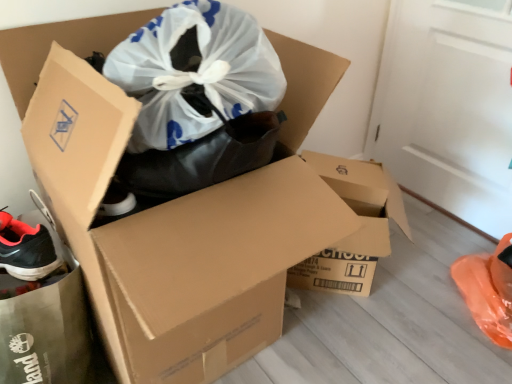
Question: Is black matte shoe at lower left outside of brown cardboard box at center, the 1th box viewed from the right?

Choices:
 (A) no
 (B) yes

Answer: (B)

Question: Can you confirm if black matte shoe at lower left is wider than brown cardboard box at center, the 1th box viewed from the right?

Choices:
 (A) yes
 (B) no

Answer: (A)

Question: Considering the relative sizes of black matte shoe at lower left and brown cardboard box at center, the 1th box viewed from the right, in the image provided, is black matte shoe at lower left bigger than brown cardboard box at center, the 1th box viewed from the right,?

Choices:
 (A) yes
 (B) no

Answer: (B)

Question: Can you confirm if black matte shoe at lower left is thinner than brown cardboard box at center, the second box in the left-to-right sequence?

Choices:
 (A) no
 (B) yes

Answer: (A)

Question: Is brown cardboard box at center, the 1th box viewed from the right, at the back of black matte shoe at lower left?

Choices:
 (A) yes
 (B) no

Answer: (B)

Question: Considering the positions of brown cardboard box at center, positioned as the first box in left-to-right order, and brown cardboard box at center, the second box in the left-to-right sequence, in the image, is brown cardboard box at center, positioned as the first box in left-to-right order, bigger or smaller than brown cardboard box at center, the second box in the left-to-right sequence,?

Choices:
 (A) big
 (B) small

Answer: (A)

Question: Would you say brown cardboard box at center, positioned as the first box in left-to-right order, is inside or outside brown cardboard box at center, the second box in the left-to-right sequence?

Choices:
 (A) outside
 (B) inside

Answer: (A)

Question: Considering their positions, is brown cardboard box at center, positioned as the first box in left-to-right order, located in front of or behind brown cardboard box at center, the 1th box viewed from the right?

Choices:
 (A) behind
 (B) front

Answer: (B)

Question: From a real-world perspective, is brown cardboard box at center, positioned as the first box in left-to-right order, physically located above or below brown cardboard box at center, the 1th box viewed from the right?

Choices:
 (A) below
 (B) above

Answer: (B)

Question: Considering the relative positions of brown cardboard box at center, positioned as the first box in left-to-right order, and black matte shoe at lower left in the image provided, is brown cardboard box at center, positioned as the first box in left-to-right order, to the left or to the right of black matte shoe at lower left?

Choices:
 (A) left
 (B) right

Answer: (B)

Question: From the image's perspective, is brown cardboard box at center, positioned as the first box in left-to-right order, above or below black matte shoe at lower left?

Choices:
 (A) below
 (B) above

Answer: (B)

Question: In terms of width, does brown cardboard box at center, positioned as the first box in left-to-right order, look wider or thinner when compared to black matte shoe at lower left?

Choices:
 (A) wide
 (B) thin

Answer: (A)

Question: In the image, is brown cardboard box at center, positioned as the first box in left-to-right order, positioned in front of or behind black matte shoe at lower left?

Choices:
 (A) behind
 (B) front

Answer: (B)

Question: Choose the correct answer: Is black matte shoe at lower left inside brown cardboard box at center, the second box in the left-to-right sequence, or outside it?

Choices:
 (A) inside
 (B) outside

Answer: (B)

Question: From their relative heights in the image, would you say black matte shoe at lower left is taller or shorter than brown cardboard box at center, the 1th box viewed from the right?

Choices:
 (A) short
 (B) tall

Answer: (B)